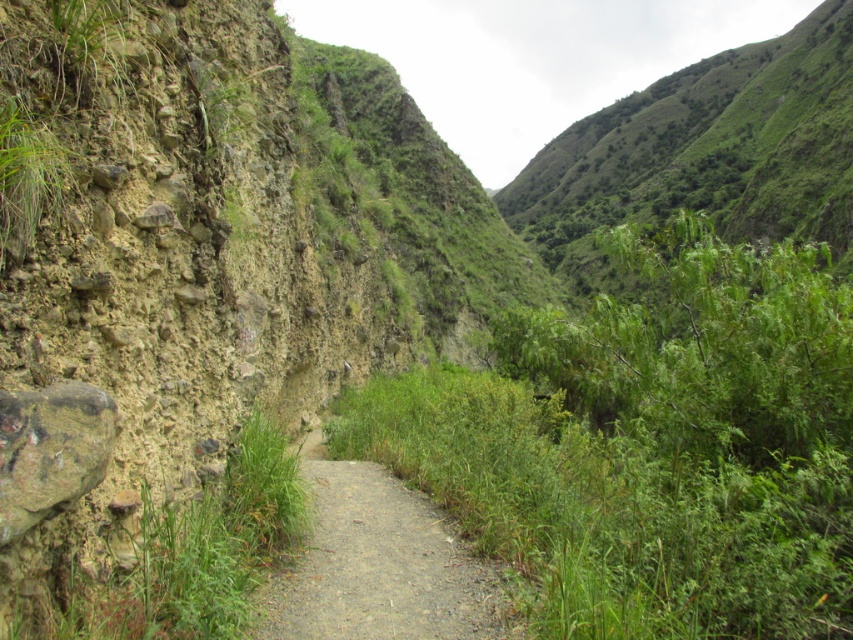
Can you confirm if green leafy bush at center is shorter than gray gravel path at center?

Incorrect, green leafy bush at center's height does not fall short of gray gravel path at center's.

Is green leafy bush at center smaller than gray gravel path at center?

No.

Is point (843, 378) in front of point (370, 509)?

Yes, it is.

At what (x,y) coordinates should I click in order to perform the action: click on green leafy bush at center. Please return your answer as a coordinate pair (x, y). Image resolution: width=853 pixels, height=640 pixels. Looking at the image, I should click on (650, 445).